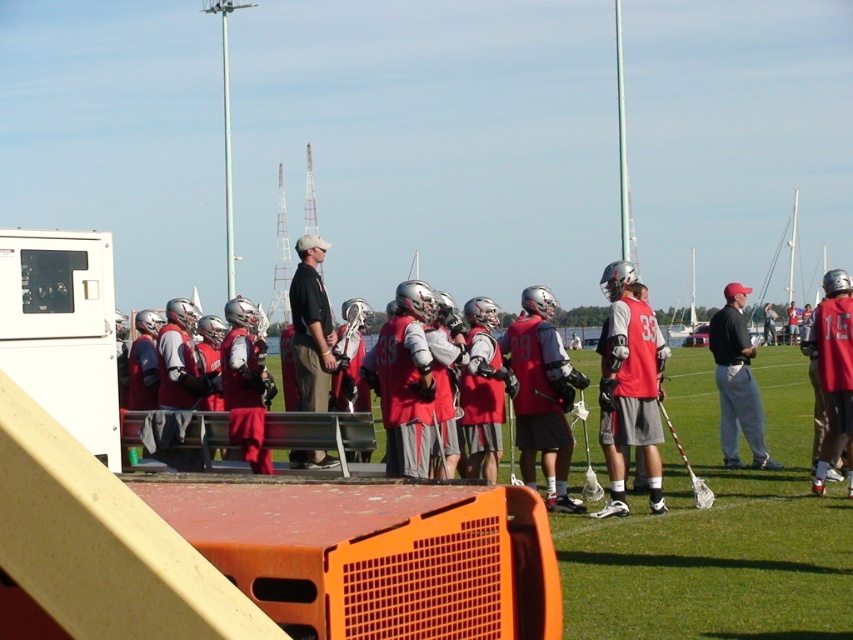
You are a photographer standing at the edge of the field. You want to take a photo that includes both the red matte jersey at center and the black smooth shirt at center. Which one will appear larger in the photo?

The red matte jersey at center will appear larger in the photo because it is closer to the viewer than the black smooth shirt at center.

You are a photographer trying to capture a closeup of the red matte jersey at center. Based on the coordinates provided, where should you position your camera relative to the jersey?

The red matte jersey at center is located at coordinates point [627,413], so you should position your camera at that point to capture the closeup.